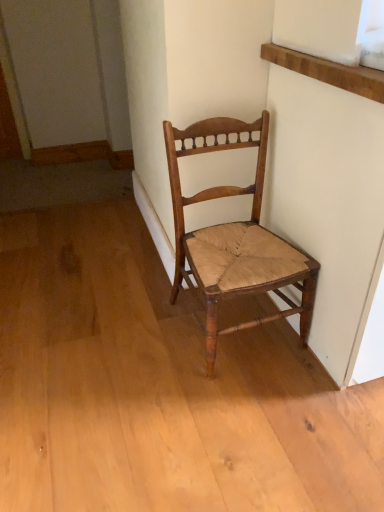
The height and width of the screenshot is (512, 384). What do you see at coordinates (234, 237) in the screenshot?
I see `natural wood chair at center` at bounding box center [234, 237].

What is the approximate width of natural wood chair at center?

It is 15.68 inches.

Where is `natural wood chair at center`? The width and height of the screenshot is (384, 512). natural wood chair at center is located at coordinates (234, 237).

Where is `natural wood chair at center`? This screenshot has width=384, height=512. natural wood chair at center is located at coordinates (234, 237).